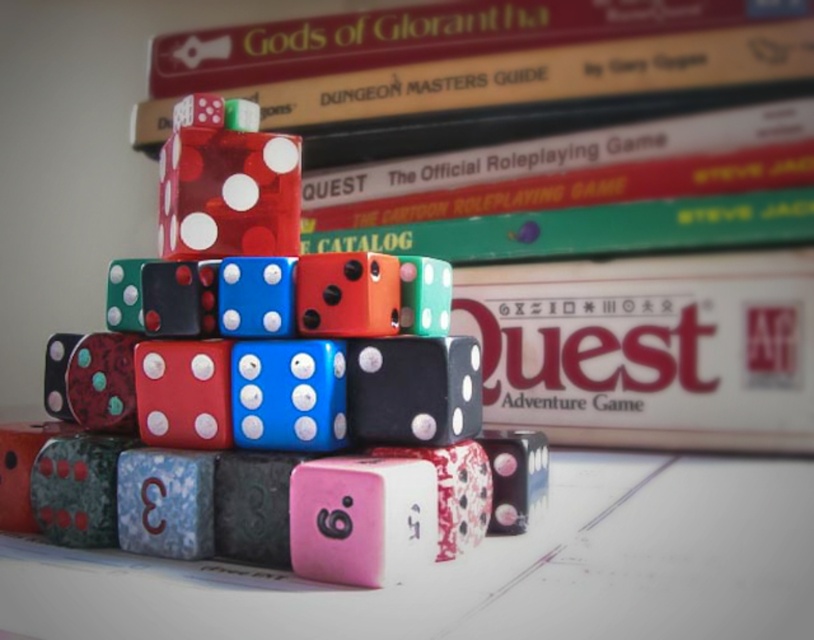
You are organizing a game night and need to place the hardcover book at center and the translucent red dice at center on a shelf. Based on their positions in the image, which item should you place first to maintain the correct arrangement?

Since the hardcover book at center is to the right of the translucent red dice at center, you should place the translucent red dice at center first on the left side of the shelf, then position the hardcover book at center to its right to maintain the correct arrangement.

You are a game master preparing for a session. You need to place a new rulebook that is 1.2 meters wide on the table between you and the hardcover book at center. Can the rulebook fit without overlapping the book?

The distance between you and the hardcover book at center is 1.30 meters. Since the rulebook is 1.2 meters wide, it can fit as long as it is placed centrally without exceeding the space available.

Looking at this image, you are standing in front of a game table and need to place a new set of dice exactly where the shiny plastic dice at center are located. According to the coordinates provided, what are the exact coordinates where you should place the new dice?

The exact coordinates for placing the new dice should be at point (274,420), as that is where the shiny plastic dice at center are located.